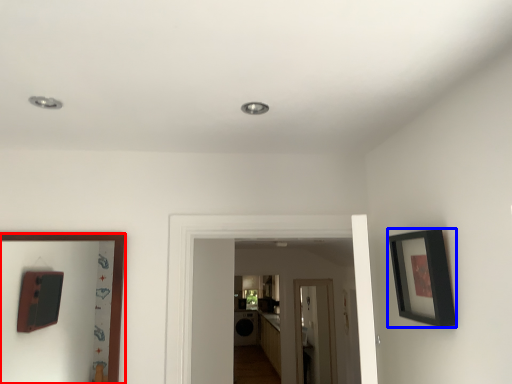
Question: Which of the following is the farthest to the observer, picture frame (highlighted by a red box) or picture frame (highlighted by a blue box)?

Choices:
 (A) picture frame
 (B) picture frame

Answer: (A)